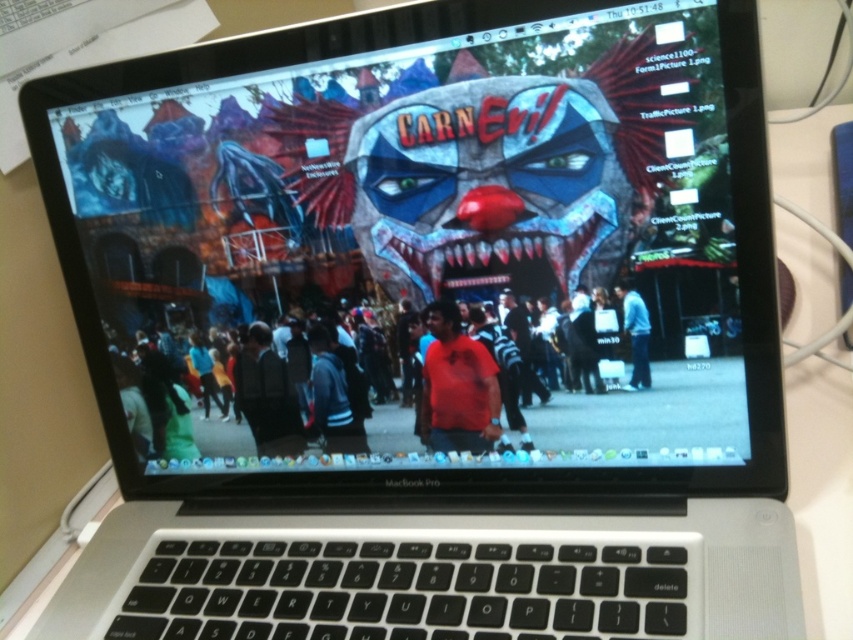
Does matte red shirt at center appear over blue denim jeans at center?

Actually, matte red shirt at center is below blue denim jeans at center.

Between matte red shirt at center and blue denim jeans at center, which one appears on the right side from the viewer's perspective?

From the viewer's perspective, blue denim jeans at center appears more on the right side.

Does point (436, 337) come farther from viewer compared to point (647, 333)?

Yes, it is behind point (647, 333).

Where is `matte red shirt at center`? Image resolution: width=853 pixels, height=640 pixels. matte red shirt at center is located at coordinates (457, 387).

Does red shirt at center have a larger size compared to matte red shirt at center?

Yes.

What do you see at coordinates (375, 372) in the screenshot?
I see `red shirt at center` at bounding box center [375, 372].

Find the location of a particular element. This screenshot has width=853, height=640. red shirt at center is located at coordinates (375, 372).

Can you confirm if red shirt at center is positioned to the left of blue denim jeans at center?

Indeed, red shirt at center is positioned on the left side of blue denim jeans at center.

What do you see at coordinates (375, 372) in the screenshot?
I see `red shirt at center` at bounding box center [375, 372].

I want to click on red shirt at center, so click(x=375, y=372).